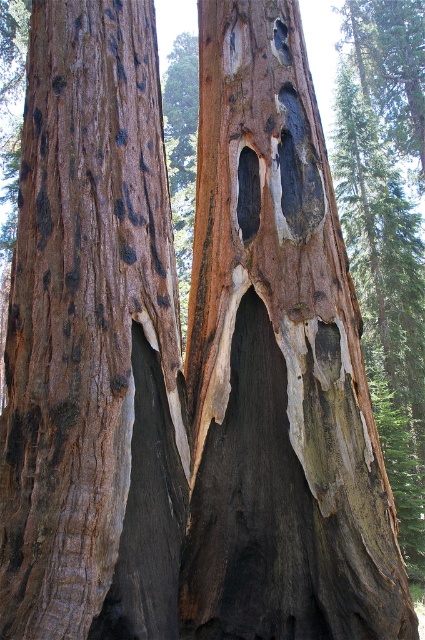
Between matte brown bark at center and smooth dark wood hole at center, which one appears on the right side from the viewer's perspective?

From the viewer's perspective, smooth dark wood hole at center appears more on the right side.

Does matte brown bark at center have a greater height compared to smooth dark wood hole at center?

Correct, matte brown bark at center is much taller as smooth dark wood hole at center.

Who is more forward, [51,534] or [251,186]?

Positioned in front is point [51,534].

Where is `matte brown bark at center`? This screenshot has height=640, width=425. matte brown bark at center is located at coordinates click(93, 340).

Which is more to the right, black rough hole at center or dark gray wood hole at upper center?

From the viewer's perspective, black rough hole at center appears more on the right side.

What do you see at coordinates (297, 168) in the screenshot? I see `black rough hole at center` at bounding box center [297, 168].

Find the location of a particular element. black rough hole at center is located at coordinates (297, 168).

This screenshot has height=640, width=425. Find the location of `black rough hole at center`. black rough hole at center is located at coordinates (297, 168).

Is point (269, 456) farther from camera compared to point (257, 225)?

No, it is not.

Between dark brown wood at center and smooth dark wood hole at center, which one is positioned lower?

dark brown wood at center

Between point (384, 472) and point (249, 227), which one is positioned in front?

Point (384, 472) is in front.

At what (x,y) coordinates should I click in order to perform the action: click on dark brown wood at center. Please return your answer as a coordinate pair (x, y). Looking at the image, I should click on (277, 369).